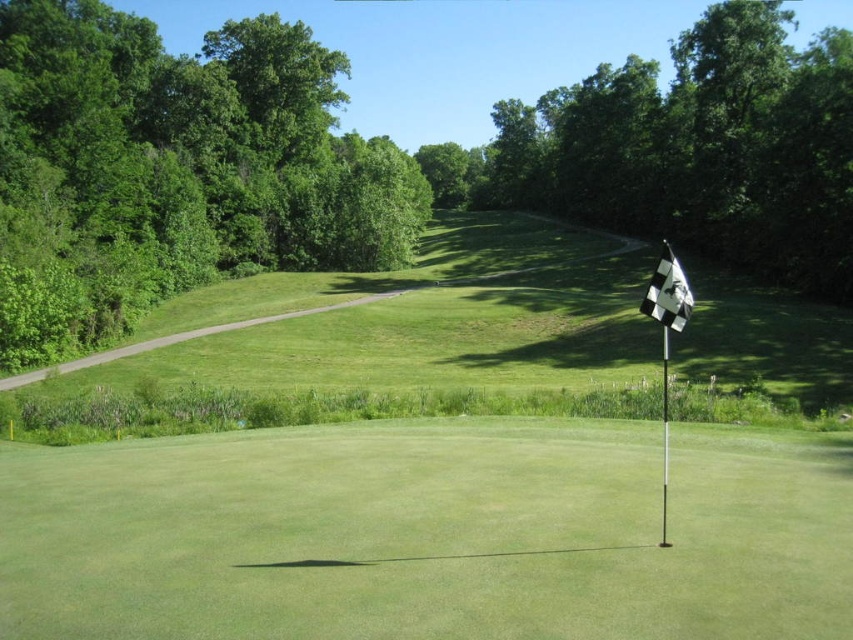
Question: Does green leafy trees at upper left appear over black checkered flag at right?

Choices:
 (A) yes
 (B) no

Answer: (A)

Question: Which point appears farthest from the camera in this image?

Choices:
 (A) (671, 269)
 (B) (370, 605)
 (C) (675, 122)

Answer: (C)

Question: Which point is closer to the camera?

Choices:
 (A) white checkered flag at center
 (B) green leafy trees at upper left
 (C) black checkered flag at right
 (D) green leafy tree at center

Answer: (A)

Question: Is the position of green leafy tree at center more distant than that of black checkered flag at right?

Choices:
 (A) yes
 (B) no

Answer: (A)

Question: Does green leafy trees at upper left appear under green leafy tree at center?

Choices:
 (A) yes
 (B) no

Answer: (A)

Question: Which of the following is the closest to the observer?

Choices:
 (A) green leafy trees at upper left
 (B) white checkered flag at center
 (C) black checkered flag at right

Answer: (B)